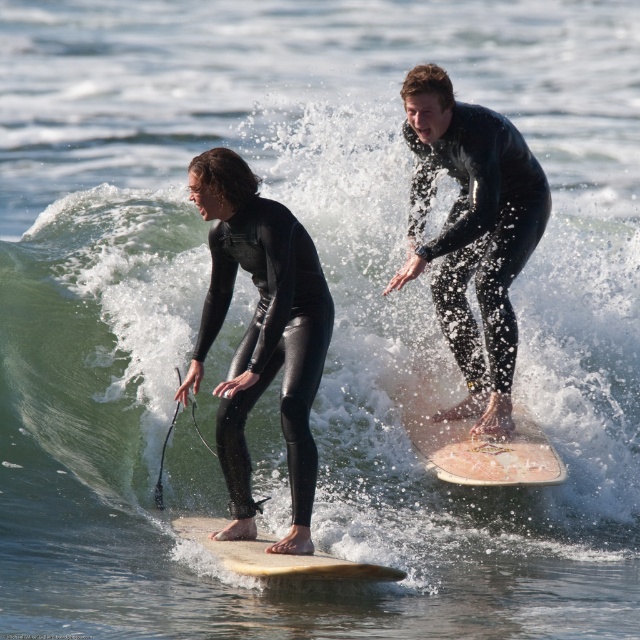
Does black matte wetsuit at upper center have a greater height compared to light brown smooth surfboard at center?

Yes.

Is black matte wetsuit at upper center to the right of light brown smooth surfboard at center from the viewer's perspective?

Correct, you'll find black matte wetsuit at upper center to the right of light brown smooth surfboard at center.

Measure the distance between black matte wetsuit at upper center and camera.

black matte wetsuit at upper center and camera are 9.52 meters apart from each other.

Where is `black matte wetsuit at upper center`? This screenshot has height=640, width=640. black matte wetsuit at upper center is located at coordinates (472, 232).

Does black matte wetsuit at upper center come in front of light pink smooth surfboard at center?

No, it is behind light pink smooth surfboard at center.

Is the position of black matte wetsuit at upper center more distant than that of light pink smooth surfboard at center?

Yes, it is.

Describe the element at coordinates (472, 232) in the screenshot. I see `black matte wetsuit at upper center` at that location.

The image size is (640, 640). I want to click on black matte wetsuit at upper center, so click(x=472, y=232).

Measure the distance between light pink smooth surfboard at center and camera.

The distance of light pink smooth surfboard at center from camera is 8.90 meters.

What do you see at coordinates (468, 436) in the screenshot?
I see `light pink smooth surfboard at center` at bounding box center [468, 436].

Find the location of a particular element. light pink smooth surfboard at center is located at coordinates (468, 436).